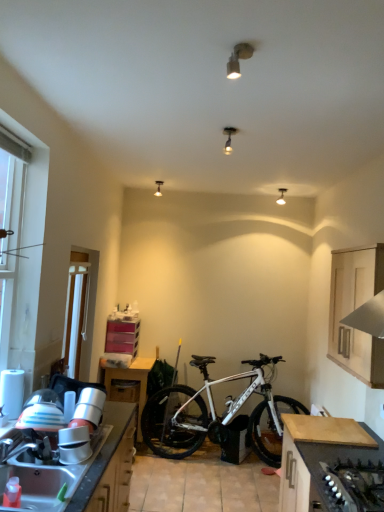
Locate an element on the screen. matte white lamp at upper center, which is the third lamp from front to back is located at coordinates (281, 196).

What is the approximate height of matte silver spotlight at upper center, the third lamp in the right-to-left sequence?

matte silver spotlight at upper center, the third lamp in the right-to-left sequence, is 5.16 inches tall.

Measure the distance between point (70,361) and camera.

They are 3.71 meters apart.

Describe the element at coordinates (355, 485) in the screenshot. The image size is (384, 512). I see `black matte gas stove at lower right` at that location.

Measure the distance between point (364, 369) and camera.

A distance of 2.43 meters exists between point (364, 369) and camera.

The image size is (384, 512). What do you see at coordinates (354, 309) in the screenshot?
I see `light wood cabinet at upper right, placed as the first cabinetry when sorted from top to bottom` at bounding box center [354, 309].

The image size is (384, 512). What do you see at coordinates (216, 414) in the screenshot?
I see `white matte bicycle at center` at bounding box center [216, 414].

In order to click on dark wood countertop at lower right, the 1th cabinetry ordered from the bottom in this screenshot , I will do `click(328, 463)`.

Find the location of a particular element. The width and height of the screenshot is (384, 512). matte white lamp at upper center, which is counted as the 2th lamp, starting from the back is located at coordinates (281, 196).

Can you confirm if white matte bicycle at center is bigger than matte white ceiling light at upper center, positioned as the first lamp in back-to-front order?

Yes, white matte bicycle at center is bigger than matte white ceiling light at upper center, positioned as the first lamp in back-to-front order.

Considering the relative sizes of white matte bicycle at center and matte white ceiling light at upper center, positioned as the first lamp in back-to-front order, in the image provided, is white matte bicycle at center shorter than matte white ceiling light at upper center, positioned as the first lamp in back-to-front order,?

No, white matte bicycle at center is not shorter than matte white ceiling light at upper center, positioned as the first lamp in back-to-front order.

What are the coordinates of `bicycle beneath the matte white ceiling light at upper center, positioned as the 4th lamp in right-to-left order (from a real-world perspective)` in the screenshot? It's located at (216, 414).

From the image's perspective, which is below, white matte bicycle at center or matte white ceiling light at upper center, positioned as the first lamp in back-to-front order?

From the image's view, white matte bicycle at center is below.

Choose the correct answer: Is metallic stainless steel sink at lower left inside white matte bicycle at center or outside it?

metallic stainless steel sink at lower left is not inside white matte bicycle at center, it's outside.

Are metallic stainless steel sink at lower left and white matte bicycle at center beside each other?

No, metallic stainless steel sink at lower left is not making contact with white matte bicycle at center.

Relative to white matte bicycle at center, is metallic stainless steel sink at lower left in front or behind?

metallic stainless steel sink at lower left is positioned closer to the viewer than white matte bicycle at center.

Is point (127, 423) positioned behind point (251, 436)?

No, it is not.

From the image's perspective, is matte white lamp at upper center, which is counted as the 4th lamp, starting from the left, above metallic stainless steel sink at lower left?

Correct, matte white lamp at upper center, which is counted as the 4th lamp, starting from the left, appears higher than metallic stainless steel sink at lower left in the image.

Does matte white lamp at upper center, which is counted as the 4th lamp, starting from the left, have a lesser height compared to metallic stainless steel sink at lower left?

Yes, matte white lamp at upper center, which is counted as the 4th lamp, starting from the left, is shorter than metallic stainless steel sink at lower left.

From the picture: Based on their sizes in the image, would you say matte white lamp at upper center, which is counted as the 4th lamp, starting from the left, is bigger or smaller than metallic stainless steel sink at lower left?

Clearly, matte white lamp at upper center, which is counted as the 4th lamp, starting from the left, is smaller in size than metallic stainless steel sink at lower left.

Is matte white lamp at upper center, the first lamp viewed from the right, further to the viewer compared to metallic stainless steel sink at lower left?

Yes, matte white lamp at upper center, the first lamp viewed from the right, is further from the camera.

How many degrees apart are the facing directions of white matte bicycle at center and light wood cabinet at upper right, marked as the second cabinetry in a bottom-to-top arrangement?

They differ by 88.7 degrees in their facing directions.

In the scene shown: From the image's perspective, which one is positioned lower, white matte bicycle at center or light wood cabinet at upper right, placed as the first cabinetry when sorted from top to bottom?

From the image's view, white matte bicycle at center is below.

Considering the points (170, 429) and (347, 361), which point is in front, point (170, 429) or point (347, 361)?

The point (347, 361) is in front.

Can light wood cabinet at upper right, marked as the second cabinetry in a bottom-to-top arrangement, be found inside white matte bicycle at center?

Actually, light wood cabinet at upper right, marked as the second cabinetry in a bottom-to-top arrangement, is outside white matte bicycle at center.

Is light wood cabinet at upper right, placed as the first cabinetry when sorted from top to bottom, in front of or behind matte white lamp at upper center, the first lamp viewed from the right, in the image?

Clearly, light wood cabinet at upper right, placed as the first cabinetry when sorted from top to bottom, is in front of matte white lamp at upper center, the first lamp viewed from the right.

From the image's perspective, would you say light wood cabinet at upper right, placed as the first cabinetry when sorted from top to bottom, is positioned over matte white lamp at upper center, which is counted as the 4th lamp, starting from the left?

Actually, light wood cabinet at upper right, placed as the first cabinetry when sorted from top to bottom, appears below matte white lamp at upper center, which is counted as the 4th lamp, starting from the left, in the image.

Which object is thinner, light wood cabinet at upper right, marked as the second cabinetry in a bottom-to-top arrangement, or matte white lamp at upper center, which is the third lamp from front to back?

Thinner between the two is matte white lamp at upper center, which is the third lamp from front to back.

Who is taller, light wood cabinet at upper right, marked as the second cabinetry in a bottom-to-top arrangement, or matte white lamp at upper center, the first lamp viewed from the right?

light wood cabinet at upper right, marked as the second cabinetry in a bottom-to-top arrangement.

From the picture: Is dark wood countertop at lower right, which appears as the 2th cabinetry when viewed from the top, at the back of matte white ceiling light at upper center, positioned as the first lamp in back-to-front order?

That's not correct — matte white ceiling light at upper center, positioned as the first lamp in back-to-front order, is not looking away from dark wood countertop at lower right, which appears as the 2th cabinetry when viewed from the top.

Considering the positions of objects matte white ceiling light at upper center, positioned as the first lamp in back-to-front order, and dark wood countertop at lower right, which appears as the 2th cabinetry when viewed from the top, in the image provided, who is more to the left, matte white ceiling light at upper center, positioned as the first lamp in back-to-front order, or dark wood countertop at lower right, which appears as the 2th cabinetry when viewed from the top,?

Positioned to the left is matte white ceiling light at upper center, positioned as the first lamp in back-to-front order.

From a real-world perspective, does dark wood countertop at lower right, which appears as the 2th cabinetry when viewed from the top, stand above light wood cabinet at upper right, marked as the second cabinetry in a bottom-to-top arrangement?

Incorrect, from a real-world perspective, dark wood countertop at lower right, which appears as the 2th cabinetry when viewed from the top, is lower than light wood cabinet at upper right, marked as the second cabinetry in a bottom-to-top arrangement.

Measure the distance between dark wood countertop at lower right, which appears as the 2th cabinetry when viewed from the top, and light wood cabinet at upper right, placed as the first cabinetry when sorted from top to bottom.

dark wood countertop at lower right, which appears as the 2th cabinetry when viewed from the top, and light wood cabinet at upper right, placed as the first cabinetry when sorted from top to bottom, are 25.67 inches apart from each other.

Is dark wood countertop at lower right, the 1th cabinetry ordered from the bottom, to the left of light wood cabinet at upper right, marked as the second cabinetry in a bottom-to-top arrangement, from the viewer's perspective?

Yes, dark wood countertop at lower right, the 1th cabinetry ordered from the bottom, is to the left of light wood cabinet at upper right, marked as the second cabinetry in a bottom-to-top arrangement.

Is dark wood countertop at lower right, which appears as the 2th cabinetry when viewed from the top, positioned beyond the bounds of light wood cabinet at upper right, placed as the first cabinetry when sorted from top to bottom?

dark wood countertop at lower right, which appears as the 2th cabinetry when viewed from the top, lies outside light wood cabinet at upper right, placed as the first cabinetry when sorted from top to bottom,'s area.

Locate an element on the screen. bicycle located in front of the matte white ceiling light at upper center, which is counted as the 4th lamp, starting from the front is located at coordinates (216, 414).

The height and width of the screenshot is (512, 384). There is a metallic stainless steel sink at lower left. What are the coordinates of `bicycle above it (from a real-world perspective)` in the screenshot? It's located at (216, 414).

Considering their positions, is wooden drawer at lower left positioned further to matte white ceiling light at upper center, positioned as the first lamp in back-to-front order, than dark wood countertop at lower right, the 1th cabinetry ordered from the bottom?

Among the two, dark wood countertop at lower right, the 1th cabinetry ordered from the bottom, is located further to matte white ceiling light at upper center, positioned as the first lamp in back-to-front order.

Looking at the image, which one is located closer to white plastic window at left, white matte bicycle at center or matte white lamp at upper center, which is counted as the 2th lamp, starting from the back?

white matte bicycle at center is positioned closer to the anchor white plastic window at left.

Which object lies nearer to the anchor point wooden table at lower left, wooden drawer at lower left or white plastic window at left?

The object closer to wooden table at lower left is wooden drawer at lower left.

Considering their positions, is matte silver spotlight at upper center, the 4th lamp from the back, positioned closer to white plastic screen door at left than wooden table at lower left?

The object closer to white plastic screen door at left is wooden table at lower left.

In the scene shown: From the image, which object appears to be farther from white matte bicycle at center, dark wood countertop at lower right, which appears as the 2th cabinetry when viewed from the top, or white plastic window at left?

white plastic window at left is further to white matte bicycle at center.

In the scene shown: Considering their positions, is black matte gas stove at lower right positioned closer to matte white ceiling light at upper center, positioned as the first lamp in back-to-front order, than white plastic screen door at left?

white plastic screen door at left is positioned closer to the anchor matte white ceiling light at upper center, positioned as the first lamp in back-to-front order.

Estimate the real-world distances between objects in this image. Which object is further from white plastic window at left, white matte bicycle at center or black matte gas stove at lower right?

white matte bicycle at center is positioned further to the anchor white plastic window at left.

Based on their spatial positions, is light wood cabinet at upper right, placed as the first cabinetry when sorted from top to bottom, or dark wood countertop at lower right, which appears as the 2th cabinetry when viewed from the top, closer to matte white lamp at upper center, which is counted as the 4th lamp, starting from the left?

Among the two, light wood cabinet at upper right, placed as the first cabinetry when sorted from top to bottom, is located nearer to matte white lamp at upper center, which is counted as the 4th lamp, starting from the left.

The height and width of the screenshot is (512, 384). I want to click on screen door between white plastic window at left and matte white ceiling light at upper center, which is counted as the 4th lamp, starting from the front, from front to back, so click(x=76, y=316).

Find the location of a particular element. The height and width of the screenshot is (512, 384). screen door between dark wood countertop at lower right, the 1th cabinetry ordered from the bottom, and matte white ceiling light at upper center, positioned as the first lamp in back-to-front order, from front to back is located at coordinates click(76, 316).

Identify the location of screen door located between matte silver spotlight at upper center, the third lamp in the right-to-left sequence, and matte white lamp at upper center, which is counted as the 2th lamp, starting from the back, in the depth direction. This screenshot has width=384, height=512. (76, 316).

The height and width of the screenshot is (512, 384). What are the coordinates of `gas stove between white plastic screen door at left and light wood cabinet at upper right, marked as the second cabinetry in a bottom-to-top arrangement, in the horizontal direction` in the screenshot? It's located at (355, 485).